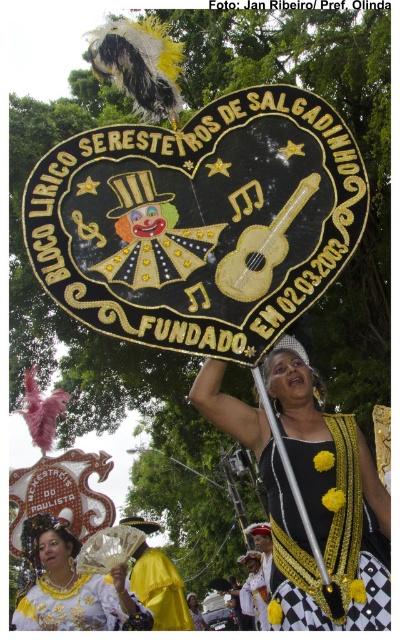
Does point (283, 609) come behind point (118, 589)?

No, (283, 609) is in front of (118, 589).

Consider the image. Is gold metallic sash at center shorter than white satin fan at lower left?

In fact, gold metallic sash at center may be taller than white satin fan at lower left.

Which is in front, point (330, 420) or point (28, 600)?

Point (330, 420)

Find the location of `gold metallic sash at center`. gold metallic sash at center is located at coordinates (324, 529).

Based on the photo, is black/yellow fabric dress at center below yellow satin cape at center?

Actually, black/yellow fabric dress at center is above yellow satin cape at center.

Based on the photo, is black/yellow fabric dress at center to the left of yellow satin cape at center from the viewer's perspective?

No, black/yellow fabric dress at center is not to the left of yellow satin cape at center.

The height and width of the screenshot is (640, 400). What are the coordinates of `black/yellow fabric dress at center` in the screenshot? It's located at (312, 493).

Between gold metallic sash at center and yellow satin cape at center, which one is positioned higher?

gold metallic sash at center is higher up.

Is gold metallic sash at center to the left of yellow satin cape at center from the viewer's perspective?

In fact, gold metallic sash at center is to the right of yellow satin cape at center.

Describe the element at coordinates (324, 529) in the screenshot. The width and height of the screenshot is (400, 640). I see `gold metallic sash at center` at that location.

Identify the location of gold metallic sash at center. This screenshot has width=400, height=640. (324, 529).